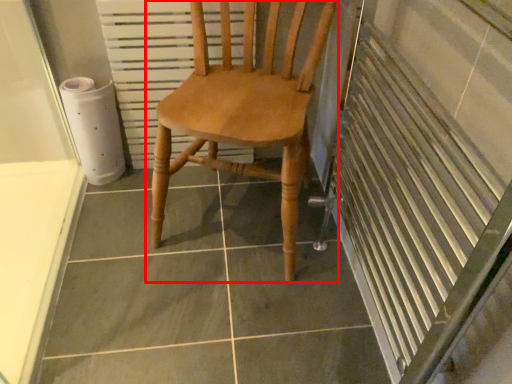
Question: From the image's perspective, what is the correct spatial relationship of chair (annotated by the red box) in relation to radiator?

Choices:
 (A) above
 (B) below

Answer: (B)